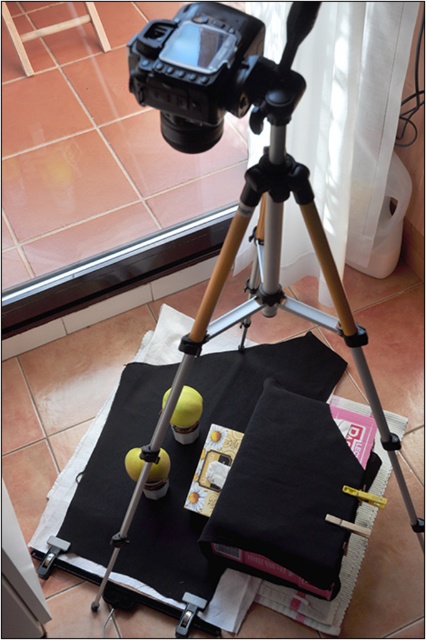
You are setting up a camera to photograph the scene described. You need to adjust the tripod so that both the black matte cloth at center and the wooden stool at upper left are in frame. Based on their positions, which object should you focus on first to ensure both are visible?

The black matte cloth at center is below the wooden stool at upper left. To ensure both are in frame, focus on the wooden stool at upper left first, as it is higher up, allowing the camera angle to capture the lower positioned black matte cloth at center in the same shot.

You are standing at a photography setup where there are two yellow spherical objects and a small box with a floral design. There is a point marked at coordinates point (259, 499). If you want to place a 1.5 meter long ladder from your current position to that point, will it fit without overlapping the items?

The distance between you and the point (259, 499) is 1.38 meters. Since the ladder is 1.5 meters long, it will be 0.12 meters too long to fit without overlapping the items.

You are setting up a camera to photograph the black matte cloth at center and the wooden stool at upper left. Since the camera is at eye level, will the stool be fully visible behind the cloth?

The black matte cloth at center is much taller than the wooden stool at upper left, so the stool will be mostly or entirely hidden behind the cloth when viewed from eye level.